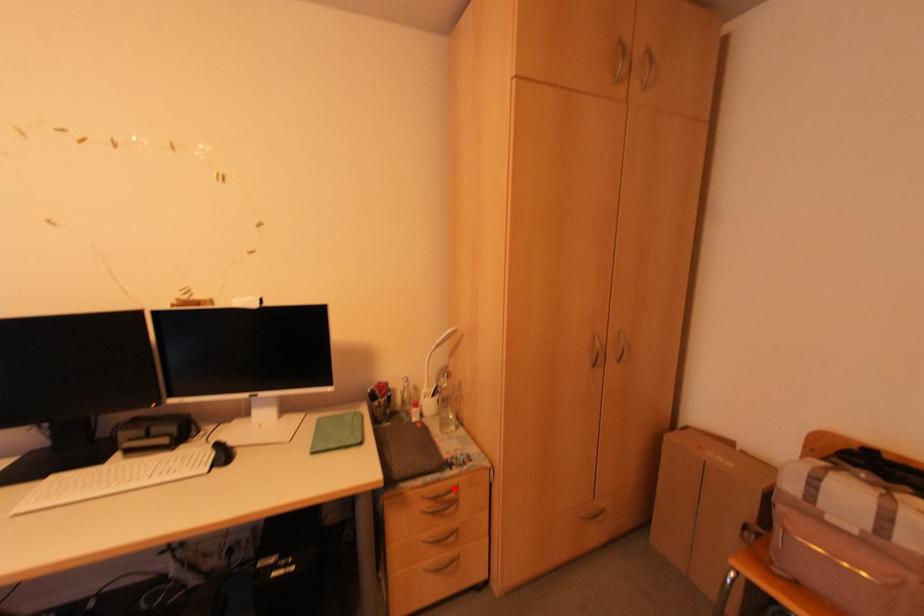
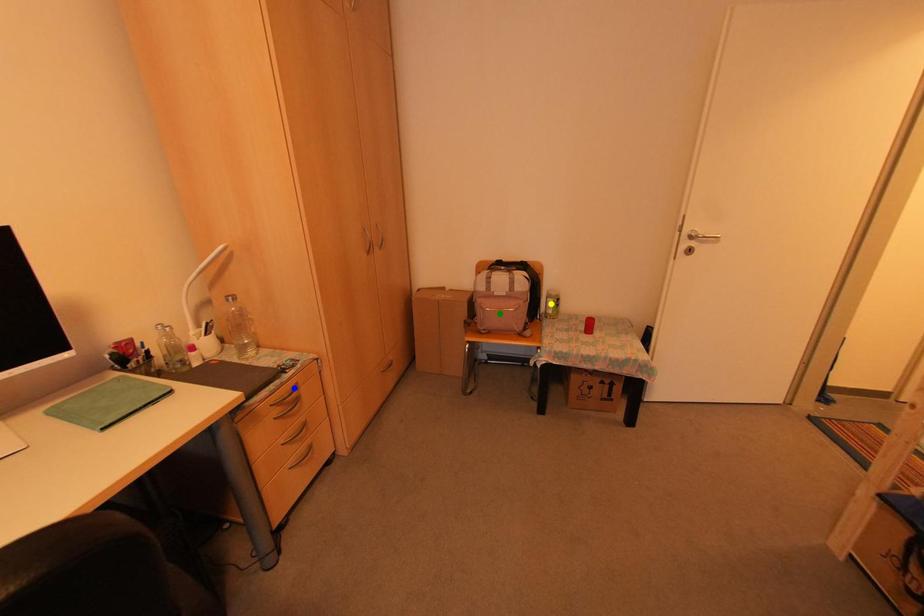
Question: I am providing you with two images of the same scene from different viewpoints. A red point is marked on the first image. You are given multiple points on the second image. Can you choose the point in image 2 that corresponds to the point in image 1?

Choices:
 (A) blue point
 (B) green point
 (C) yellow point

Answer: (A)